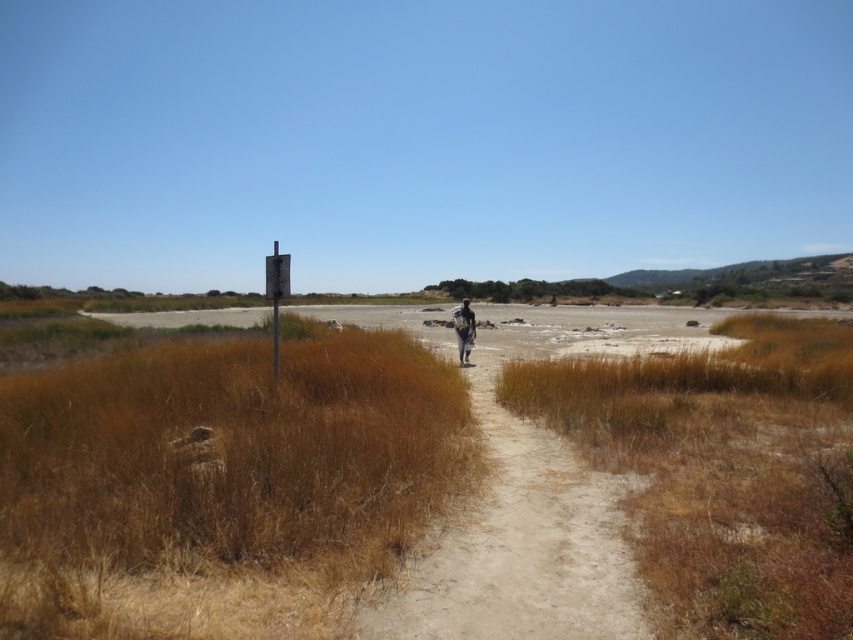
Question: Is brown dry grass at lower left bigger than dark blue fabric at center?

Choices:
 (A) no
 (B) yes

Answer: (B)

Question: Among these objects, which one is nearest to the camera?

Choices:
 (A) dark blue fabric at center
 (B) brown dry grass at lower left

Answer: (B)

Question: Which object is farther from the camera taking this photo?

Choices:
 (A) dark blue fabric at center
 (B) brown dry grass at lower left

Answer: (A)

Question: Does brown dry grass at lower left appear over dark blue fabric at center?

Choices:
 (A) no
 (B) yes

Answer: (A)

Question: Does brown dry grass at lower left have a larger size compared to dark blue fabric at center?

Choices:
 (A) yes
 (B) no

Answer: (A)